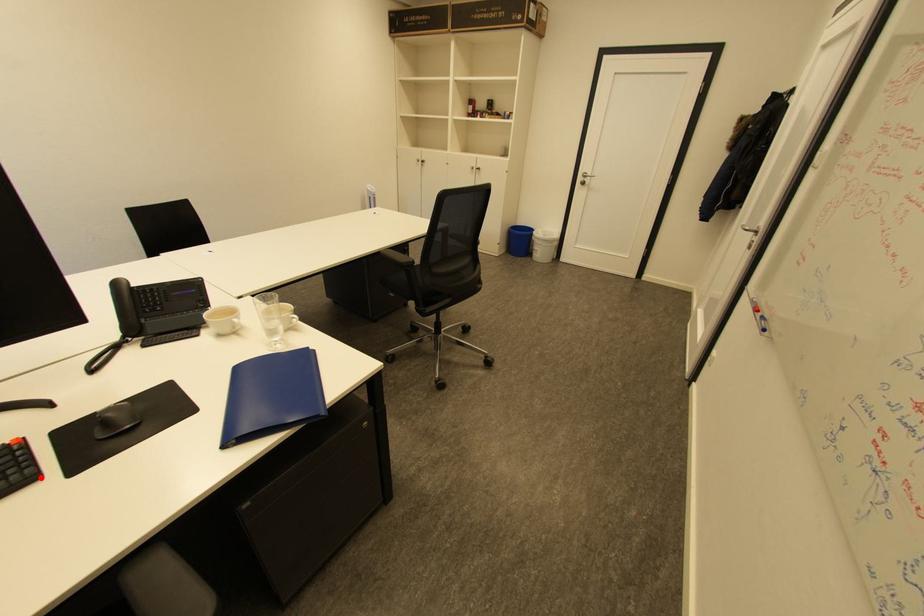
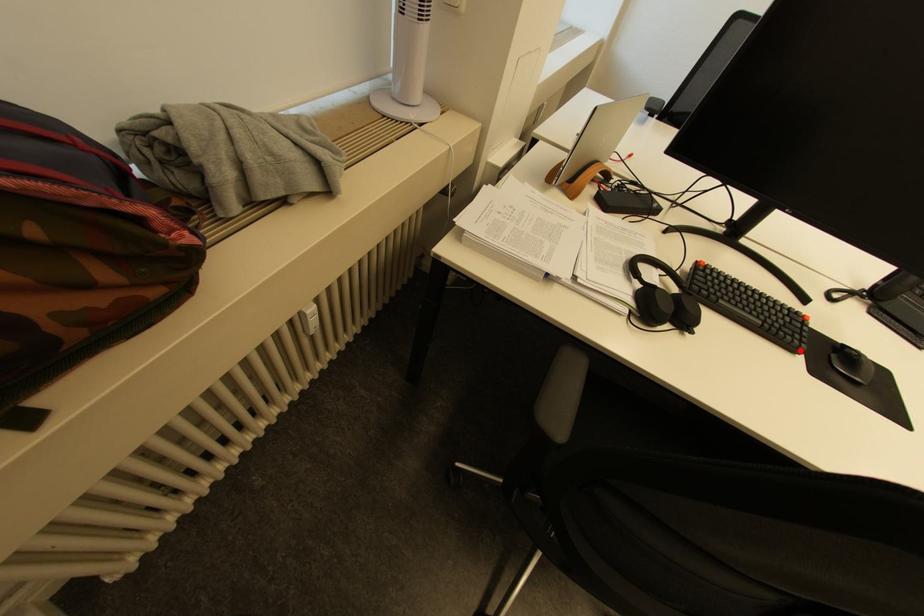
I am providing you with two images of the same scene from different viewpoints. A red point is marked on the first image and another point is marked on the second image. Does the point marked in image1 correspond to the same location as the one in image2?

Yes